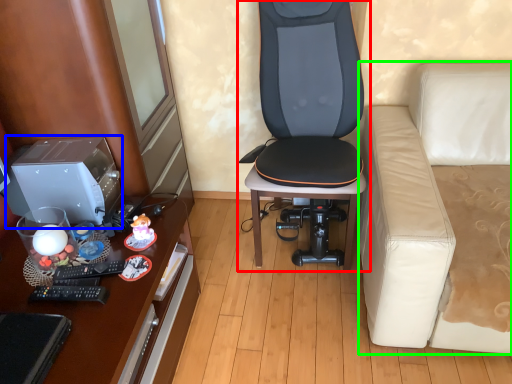
Question: Considering the real-world distances, which object is closest to chair (highlighted by a red box)? desktop computer (highlighted by a blue box) or studio couch (highlighted by a green box).

Choices:
 (A) desktop computer
 (B) studio couch

Answer: (B)